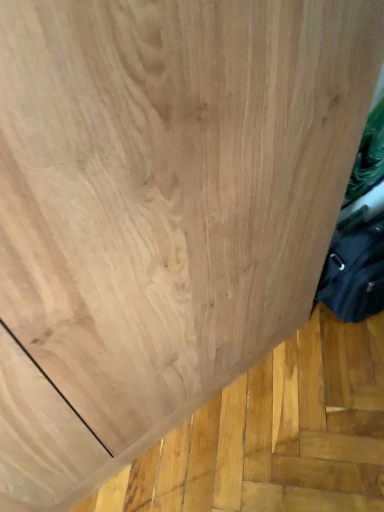
What do you see at coordinates (355, 273) in the screenshot? I see `black fabric bag at lower right` at bounding box center [355, 273].

What is the approximate width of black fabric bag at lower right?

The width of black fabric bag at lower right is 6.74 inches.

The width and height of the screenshot is (384, 512). Identify the location of black fabric bag at lower right. (355, 273).

Find the location of a particular element. This screenshot has height=512, width=384. black fabric bag at lower right is located at coordinates (355, 273).